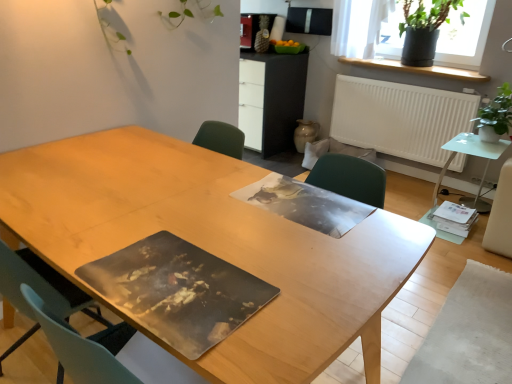
Question: Can you confirm if wooden table at center, the 1th table positioned from the left, is thinner than green matte plant pot at upper right?

Choices:
 (A) no
 (B) yes

Answer: (A)

Question: Is wooden table at center, the 1th table positioned from the left, shorter than green matte plant pot at upper right?

Choices:
 (A) yes
 (B) no

Answer: (B)

Question: Is the depth of wooden table at center, the second table in the back-to-front sequence, less than that of green matte plant pot at upper right?

Choices:
 (A) yes
 (B) no

Answer: (A)

Question: From a real-world perspective, is wooden table at center, the 1th table positioned from the left, located beneath green matte plant pot at upper right?

Choices:
 (A) yes
 (B) no

Answer: (A)

Question: Is wooden table at center, the 1th table positioned from the left, smaller than green matte plant pot at upper right?

Choices:
 (A) no
 (B) yes

Answer: (A)

Question: From a real-world perspective, is wooden table at center, marked as the first table in a front-to-back arrangement, physically above green matte plant pot at upper right?

Choices:
 (A) yes
 (B) no

Answer: (B)

Question: From a real-world perspective, is green matte plant pot at upper right, the 2th houseplant ordered from the bottom, positioned over green leafy plant at right, the 1th houseplant when ordered from front to back, based on gravity?

Choices:
 (A) yes
 (B) no

Answer: (A)

Question: Is the depth of green matte plant pot at upper right, the 2th houseplant ordered from the bottom, less than that of green leafy plant at right, the 2th houseplant from the back?

Choices:
 (A) no
 (B) yes

Answer: (A)

Question: Considering the relative sizes of green matte plant pot at upper right, the 2th houseplant ordered from the bottom, and green leafy plant at right, which is the second houseplant in top-to-bottom order, in the image provided, is green matte plant pot at upper right, the 2th houseplant ordered from the bottom, smaller than green leafy plant at right, which is the second houseplant in top-to-bottom order,?

Choices:
 (A) yes
 (B) no

Answer: (B)

Question: Does green matte plant pot at upper right, the 2th houseplant ordered from the bottom, have a greater width compared to green leafy plant at right, the 2th houseplant from the back?

Choices:
 (A) yes
 (B) no

Answer: (A)

Question: Could you tell me if green matte plant pot at upper right, acting as the 1th houseplant starting from the top, is facing green leafy plant at right, the 1th houseplant when ordered from front to back?

Choices:
 (A) yes
 (B) no

Answer: (B)

Question: Can you confirm if green matte plant pot at upper right, acting as the 1th houseplant starting from the top, is positioned to the left of green leafy plant at right, the 1th houseplant when ordered from front to back?

Choices:
 (A) no
 (B) yes

Answer: (B)

Question: Considering the relative positions of green leafy plant at right, the 2th houseplant from the back, and green matte plant pot at upper right in the image provided, is green leafy plant at right, the 2th houseplant from the back, to the right of green matte plant pot at upper right from the viewer's perspective?

Choices:
 (A) no
 (B) yes

Answer: (B)